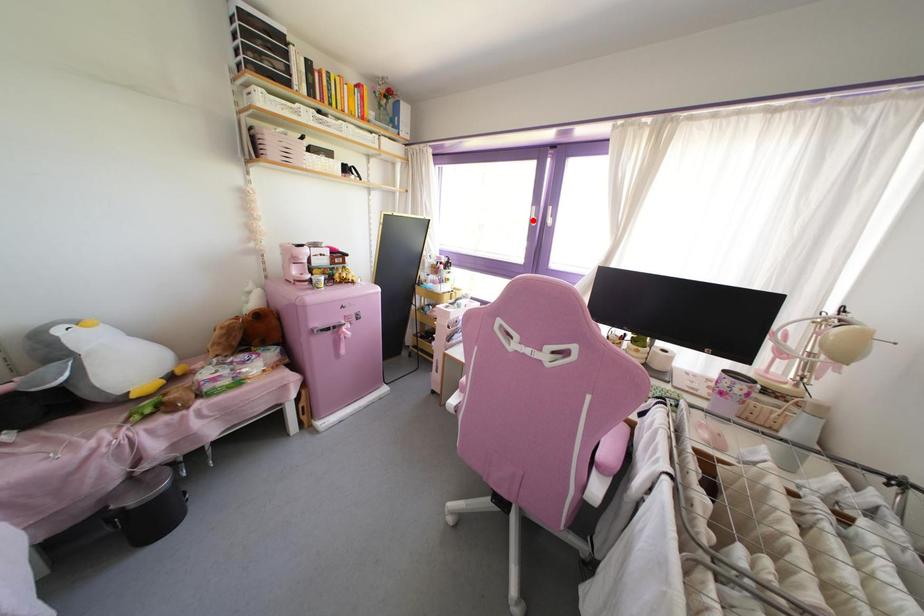
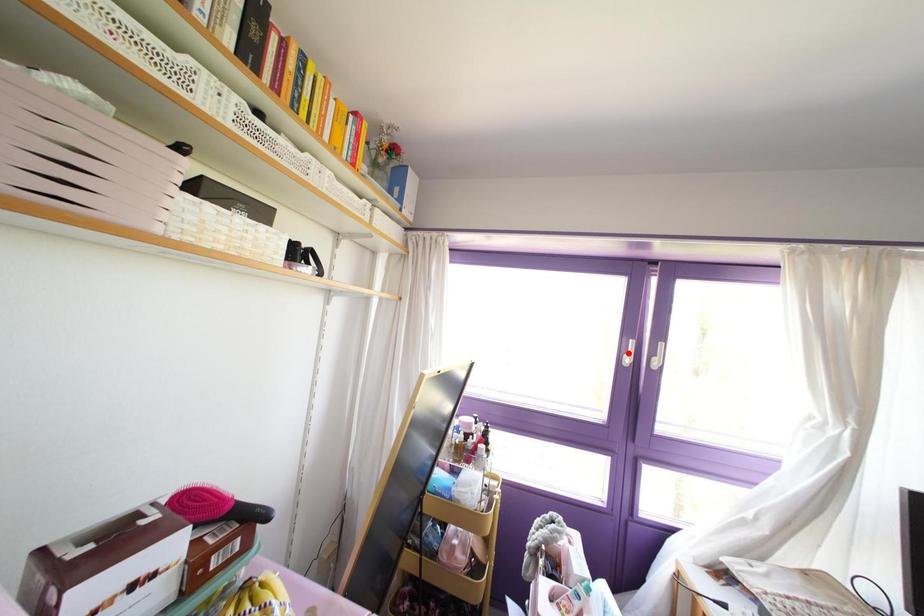
I am providing you with two images of the same scene from different viewpoints. A red point is marked on the first image and another point is marked on the second image. Do the highlighted points in image1 and image2 indicate the same real-world spot?

No